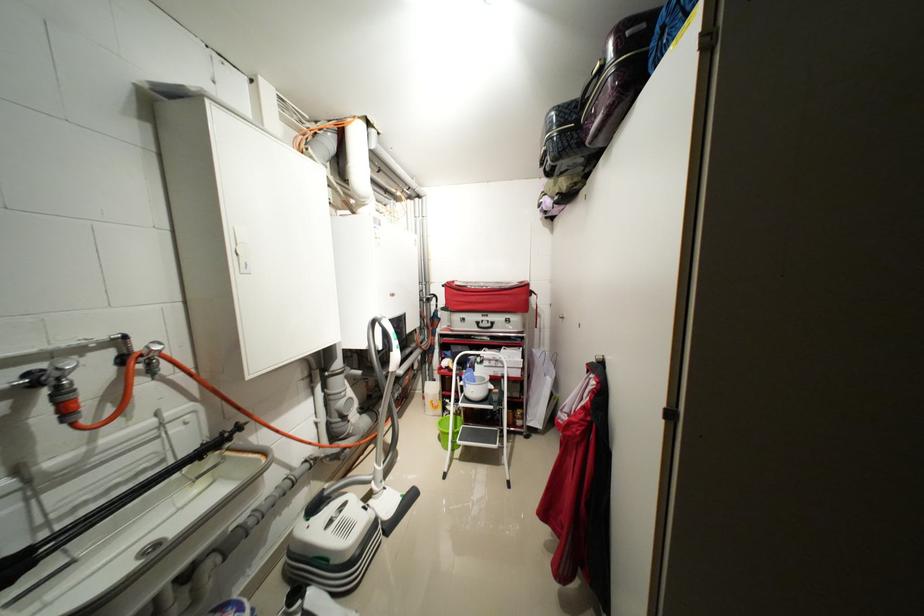
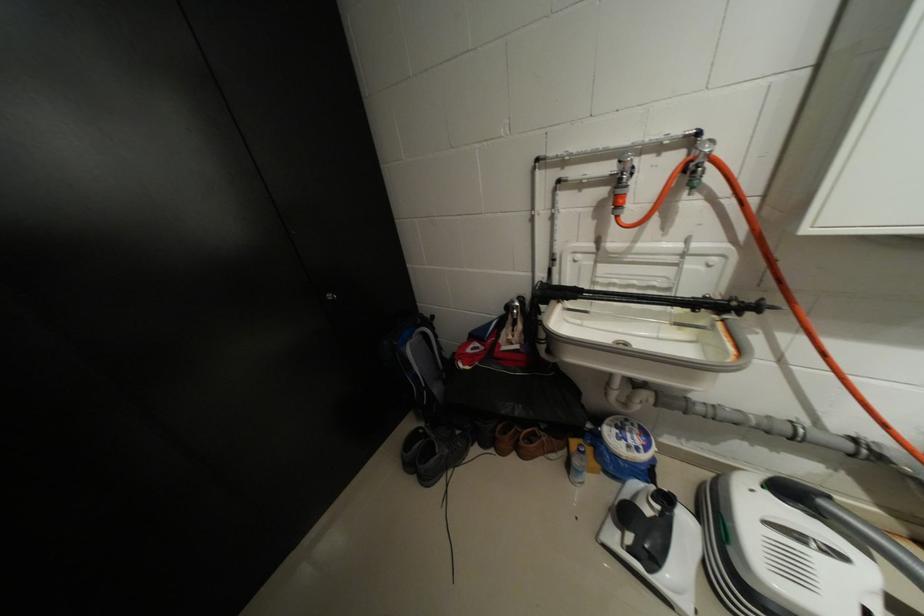
Based on the continuous images, in which direction is the camera rotating?

The camera's rotation is toward left-down.